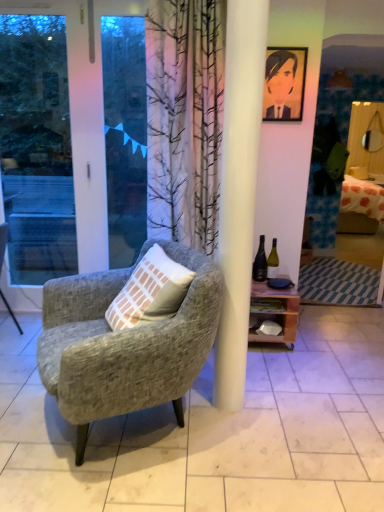
Locate an element on the screen. space that is in front of wooden at right is located at coordinates (285, 366).